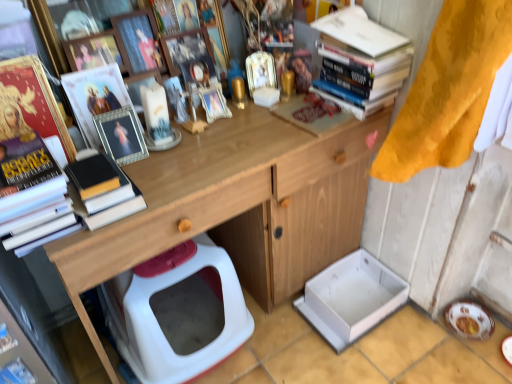
You are a GUI agent. You are given a task and a screenshot of the screen. Output one action in this format:
    pyautogui.click(x=<x>, y=<y>)
    Task: Click on the vacant area that is in front of gold metallic bottle at center
    The image size is (512, 384).
    Given the screenshot: What is the action you would take?
    pyautogui.click(x=242, y=132)